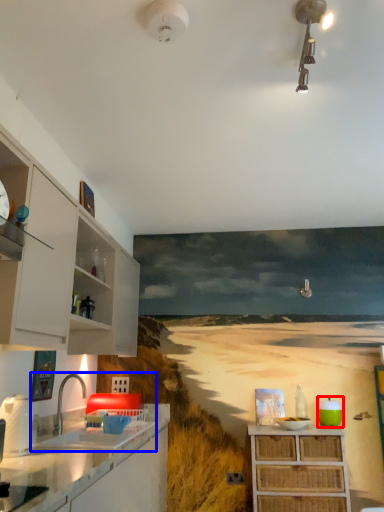
Question: Which object appears closest to the camera in this image, appliance (highlighted by a red box) or sink (highlighted by a blue box)?

Choices:
 (A) appliance
 (B) sink

Answer: (B)